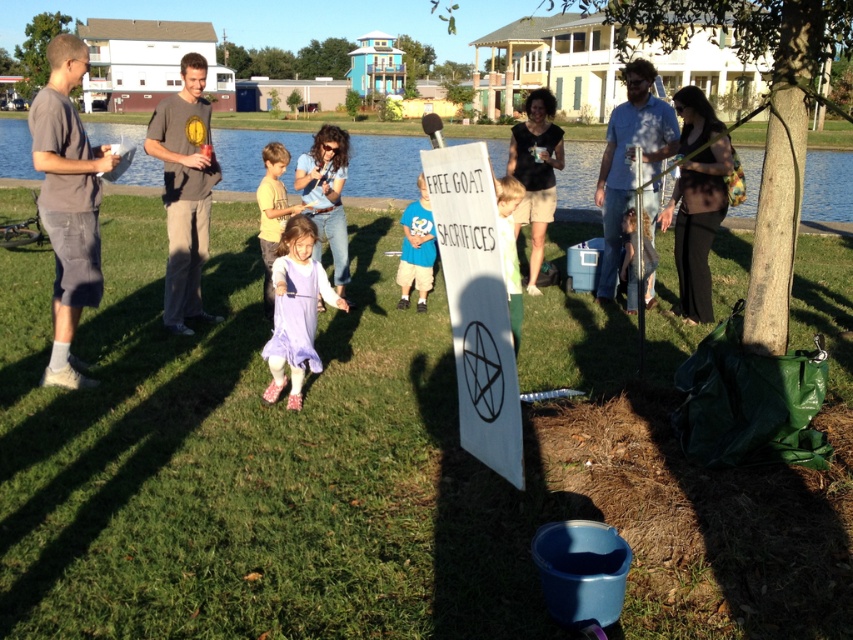
Between green grass at center and light brown hair at center, which one is positioned higher?

light brown hair at center is above.

Which is behind, point (213, 284) or point (515, 182)?

Point (213, 284)

Where is `green grass at center`? The height and width of the screenshot is (640, 853). green grass at center is located at coordinates (384, 467).

Where is `white paper sign at center`? The image size is (853, 640). white paper sign at center is located at coordinates (476, 305).

Which is behind, point (489, 259) or point (421, 193)?

Point (421, 193)

Between point (468, 397) and point (421, 307), which one is positioned behind?

Positioned behind is point (421, 307).

This screenshot has height=640, width=853. In order to click on white paper sign at center in this screenshot , I will do `click(476, 305)`.

Which is below, green grass at center or blue water at lake left?

green grass at center

Between green grass at center and blue water at lake left, which one appears on the left side from the viewer's perspective?

blue water at lake left is more to the left.

Measure the distance between point (x=660, y=490) and camera.

A distance of 3.77 meters exists between point (x=660, y=490) and camera.

Find the location of a particular element. Image resolution: width=853 pixels, height=640 pixels. green grass at center is located at coordinates (384, 467).